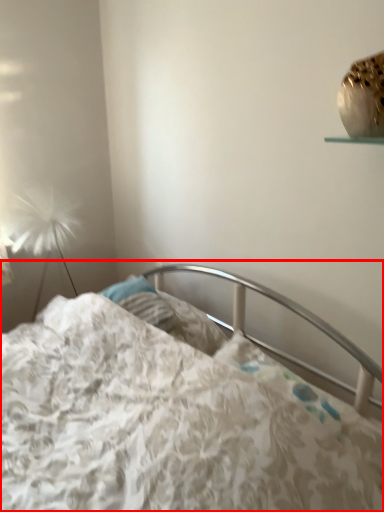
Question: From the image's perspective, what is the correct spatial relationship of bed (annotated by the red box) in relation to lamp?

Choices:
 (A) below
 (B) above

Answer: (A)